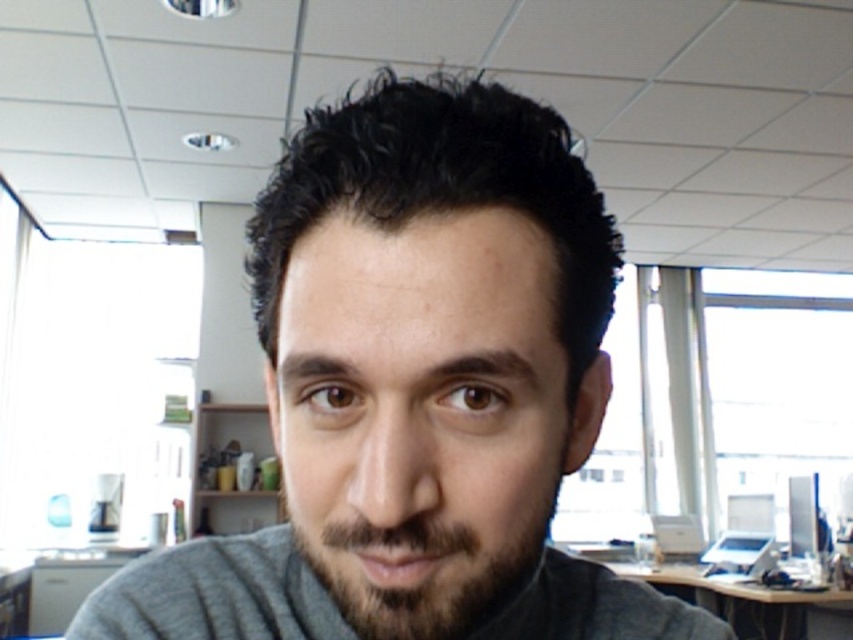
Between gray matte shirt at center and dark brown fuzzy beard at center, which one appears on the right side from the viewer's perspective?

From the viewer's perspective, dark brown fuzzy beard at center appears more on the right side.

Between point (560, 259) and point (422, 513), which one is positioned in front?

Positioned in front is point (422, 513).

This screenshot has height=640, width=853. In order to click on gray matte shirt at center in this screenshot , I will do `click(416, 390)`.

Which is more to the right, gray matte shirt at center or wooden desk at lower right?

From the viewer's perspective, wooden desk at lower right appears more on the right side.

Looking at this image, measure the distance between gray matte shirt at center and camera.

gray matte shirt at center is 9.50 inches away from camera.

Which is behind, point (427, 244) or point (749, 595)?

Point (749, 595)

Find the location of `gray matte shirt at center`. gray matte shirt at center is located at coordinates (416, 390).

Who is positioned more to the right, dark brown fuzzy beard at center or wooden desk at lower right?

From the viewer's perspective, wooden desk at lower right appears more on the right side.

Identify the location of dark brown fuzzy beard at center. (430, 556).